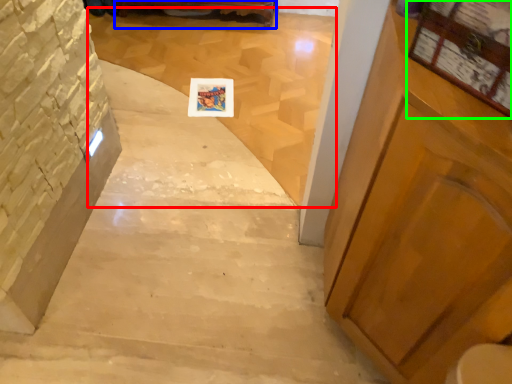
Question: Based on their relative distances, which object is nearer to stairwell (highlighted by a red box)? Choose from furniture (highlighted by a blue box) and bulletin board (highlighted by a green box).

Choices:
 (A) furniture
 (B) bulletin board

Answer: (A)